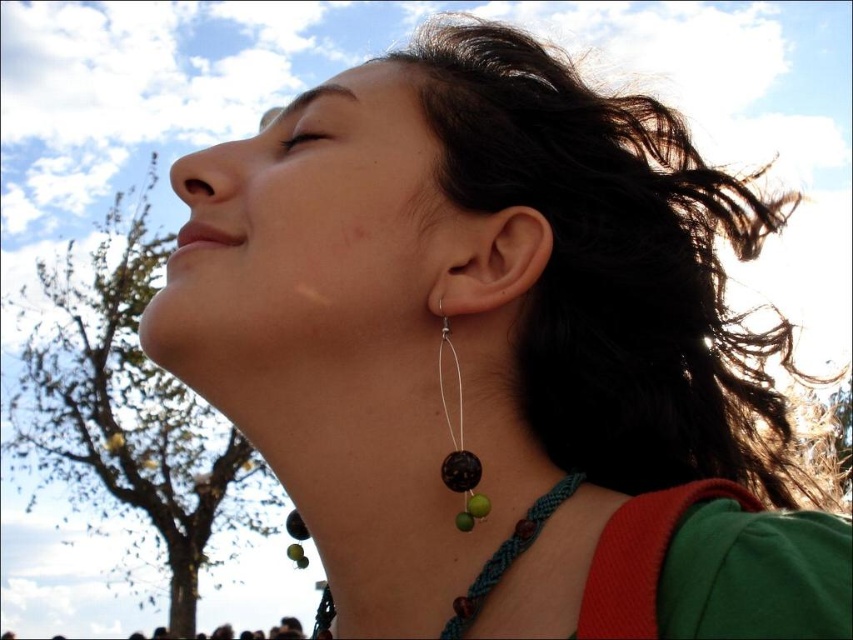
You are a photographer trying to capture a close detail shot of the person in the scene. You want to ensure that both the black beaded necklace at center and the matte skin at center are clearly visible in the frame. Given their sizes, which object should you focus on to ensure both are in focus?

The black beaded necklace at center has a larger width than the matte skin at center, so focusing on the larger object will help ensure both are in focus.